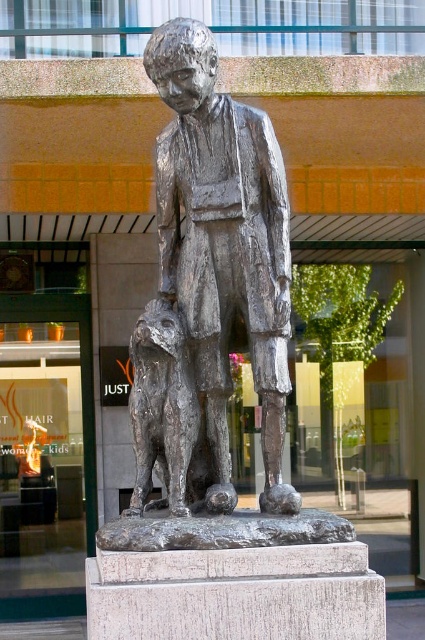
Based on the photo, can you confirm if polished silver statue at center is positioned to the right of shiny bronze dog at center?

Correct, you'll find polished silver statue at center to the right of shiny bronze dog at center.

Does point (263, 276) come behind point (139, 380)?

No, it is not.

Identify the location of polished silver statue at center. (223, 244).